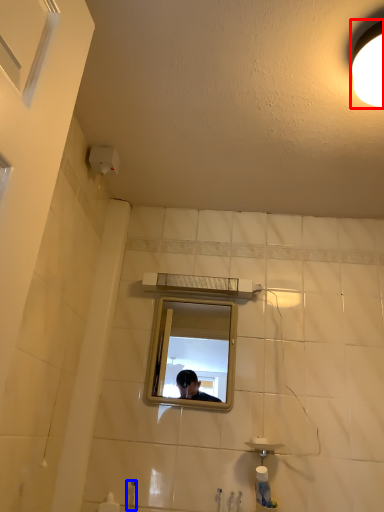
Question: Which object is closer to the camera taking this photo, light fixture (highlighted by a red box) or faucet (highlighted by a blue box)?

Choices:
 (A) light fixture
 (B) faucet

Answer: (A)